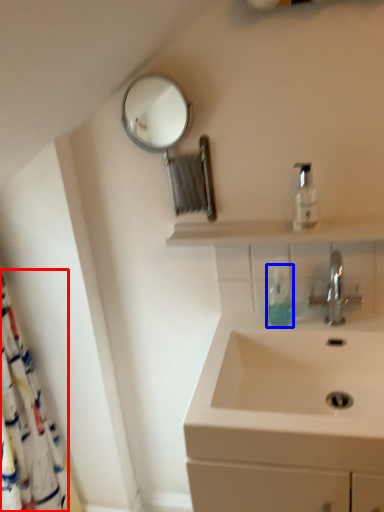
Question: Which object is further to the camera taking this photo, shower curtain (highlighted by a red box) or soap dispenser (highlighted by a blue box)?

Choices:
 (A) shower curtain
 (B) soap dispenser

Answer: (B)